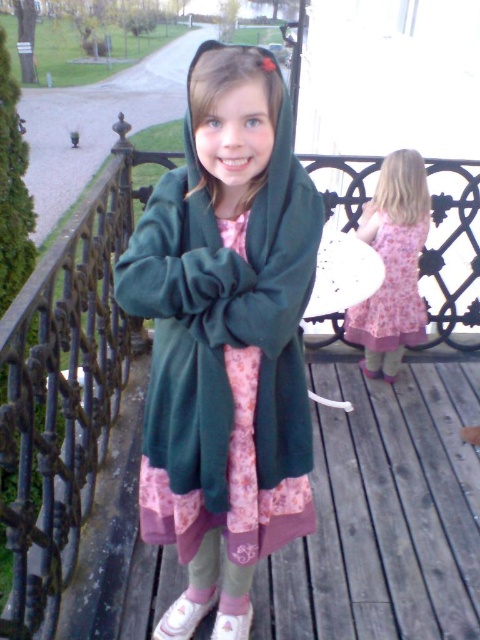
You are a tailor who needs to determine which garment requires more fabric to make between the dark green fleece coat at center and the pink floral dress at center. Based on their sizes in the image, which one would need more fabric?

The dark green fleece coat at center requires more fabric because its width is larger than the pink floral dress at center.

You are a photographer trying to capture the girl in the scene. You want to ensure both the dark green fleece coat at center and the pink floral dress at center are visible in your shot. Which object should you focus on to include both?

The dark green fleece coat at center is positioned on the left side of pink floral dress at center. To include both in your shot, focus on the area between them where they are closest.

Where is the dark green fleece coat at center located in the image?

The dark green fleece coat at center is located at point (x=226, y=337) in the image.